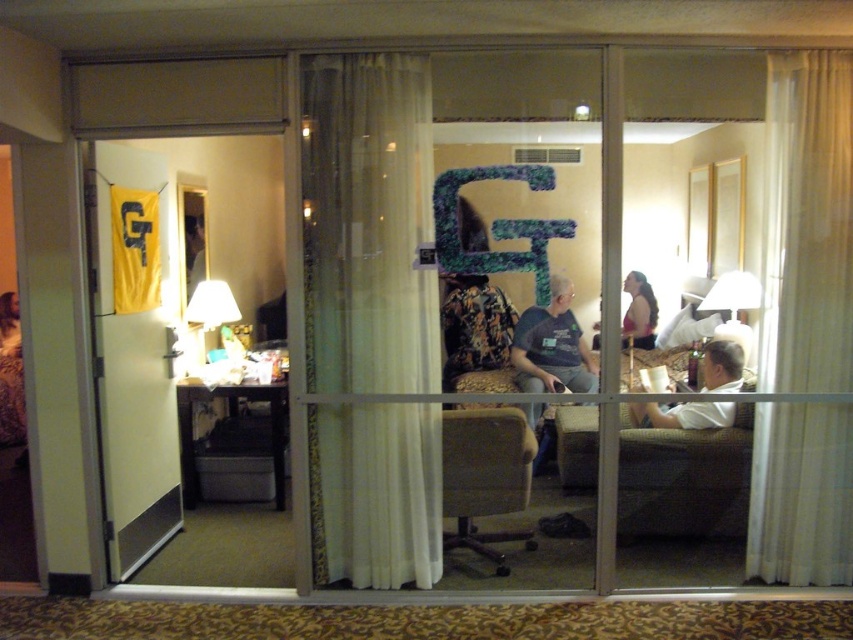
You are a hotel guest who wants to ensure privacy. The white sheer curtain at right and the matte pink tank top at center are both in your room. Which object can you adjust to cover more horizontal space for privacy?

The white sheer curtain at right can cover more horizontal space for privacy since its width surpasses that of the matte pink tank top at center.